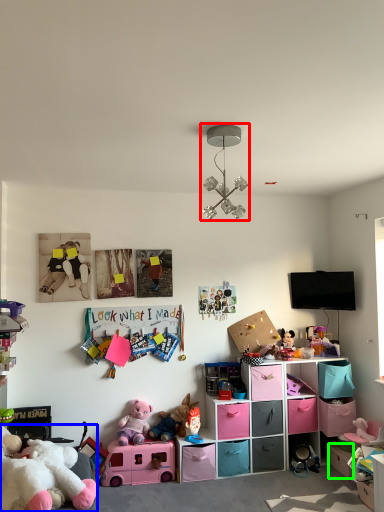
Question: Which is farther away from light fixture (highlighted by a red box)? toy (highlighted by a blue box) or storage box (highlighted by a green box)?

Choices:
 (A) toy
 (B) storage box

Answer: (B)